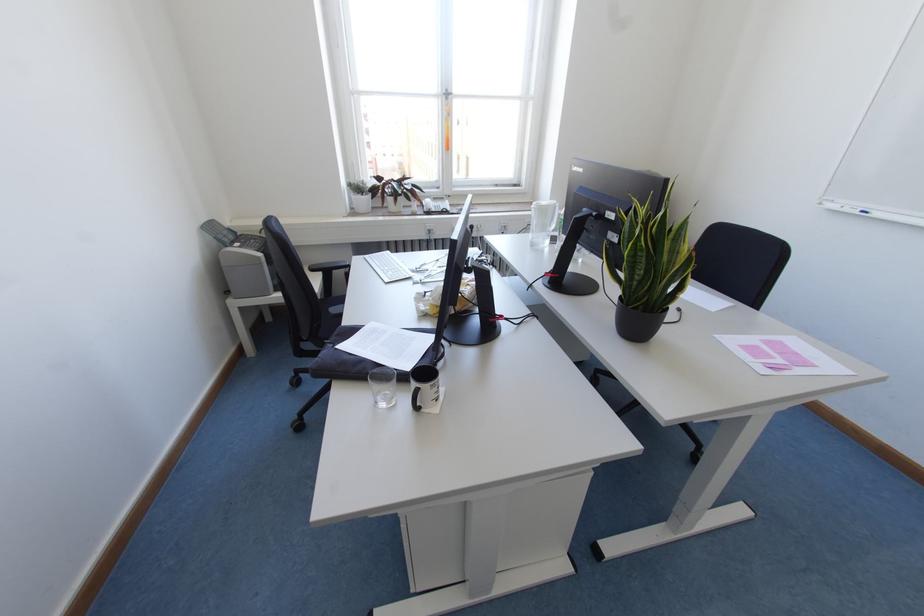
Find the location of `black mug handle`. black mug handle is located at coordinates (416, 399).